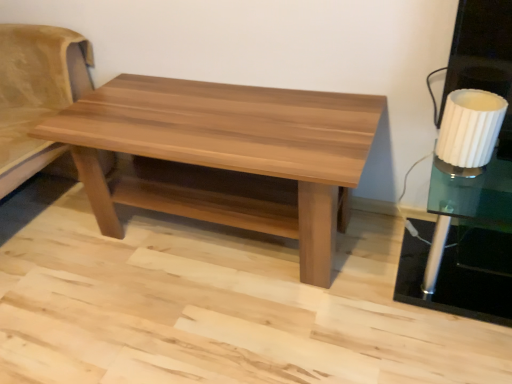
You are a GUI agent. You are given a task and a screenshot of the screen. Output one action in this format:
    pyautogui.click(x=<x>, y=<y>)
    Task: Click on the empty space that is ontop of light brown wood coffee table at center (from a real-world perspective)
    
    Given the screenshot: What is the action you would take?
    pyautogui.click(x=219, y=114)